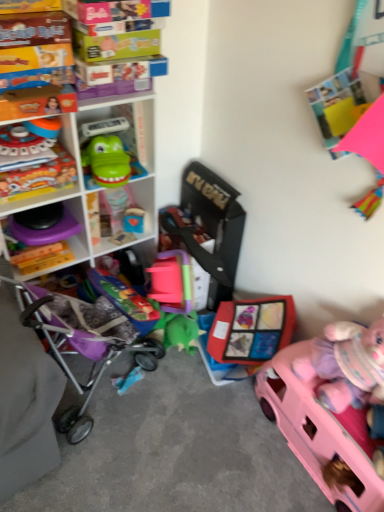
Question: From a real-world perspective, is wooden block at center, which appears as the 3th toy when viewed from the right, physically below pink plastic car at lower right, acting as the first toy starting from the right?

Choices:
 (A) yes
 (B) no

Answer: (B)

Question: Is wooden block at center, arranged as the 4th toy when viewed from the left, to the left of pink plastic car at lower right, acting as the first toy starting from the right, from the viewer's perspective?

Choices:
 (A) yes
 (B) no

Answer: (A)

Question: Is wooden block at center, which appears as the 3th toy when viewed from the right, wider than pink plastic car at lower right, positioned as the 6th toy in left-to-right order?

Choices:
 (A) yes
 (B) no

Answer: (B)

Question: Is wooden block at center, which appears as the 3th toy when viewed from the right, aimed at pink plastic car at lower right, positioned as the 6th toy in left-to-right order?

Choices:
 (A) no
 (B) yes

Answer: (A)

Question: Considering the relative sizes of wooden block at center, arranged as the 4th toy when viewed from the left, and pink plastic car at lower right, acting as the first toy starting from the right, in the image provided, is wooden block at center, arranged as the 4th toy when viewed from the left, thinner than pink plastic car at lower right, acting as the first toy starting from the right,?

Choices:
 (A) yes
 (B) no

Answer: (A)

Question: From a real-world perspective, is green rubber toy at center-left, marked as the fourth toy in a right-to-left arrangement, above or below matte plastic toy at left, which appears as the fifth toy when viewed from the right?

Choices:
 (A) below
 (B) above

Answer: (B)

Question: Is green rubber toy at center-left, the 3th toy viewed from the left, to the left or to the right of matte plastic toy at left, which appears as the fifth toy when viewed from the right, in the image?

Choices:
 (A) right
 (B) left

Answer: (A)

Question: From the image's perspective, is green rubber toy at center-left, marked as the fourth toy in a right-to-left arrangement, above or below matte plastic toy at left, the 2th toy viewed from the left?

Choices:
 (A) below
 (B) above

Answer: (B)

Question: Do you think green rubber toy at center-left, marked as the fourth toy in a right-to-left arrangement, is within matte plastic toy at left, the 2th toy viewed from the left, or outside of it?

Choices:
 (A) inside
 (B) outside

Answer: (B)

Question: Relative to matte plastic toy at left, the 2th toy viewed from the left, is purple fabric baby carriage at lower left in front or behind?

Choices:
 (A) front
 (B) behind

Answer: (A)

Question: From a real-world perspective, is purple fabric baby carriage at lower left above or below matte plastic toy at left, which appears as the fifth toy when viewed from the right?

Choices:
 (A) above
 (B) below

Answer: (B)

Question: Looking at their shapes, would you say purple fabric baby carriage at lower left is wider or thinner than matte plastic toy at left, which appears as the fifth toy when viewed from the right?

Choices:
 (A) thin
 (B) wide

Answer: (B)

Question: Is purple fabric baby carriage at lower left spatially inside matte plastic toy at left, the 2th toy viewed from the left, or outside of it?

Choices:
 (A) inside
 (B) outside

Answer: (B)

Question: Considering their positions, is pink plastic car at lower right, acting as the first toy starting from the right, located in front of or behind matte plastic toy at center, acting as the second toy starting from the right?

Choices:
 (A) front
 (B) behind

Answer: (A)

Question: Is point (302, 409) closer or farther from the camera than point (274, 298)?

Choices:
 (A) farther
 (B) closer

Answer: (B)